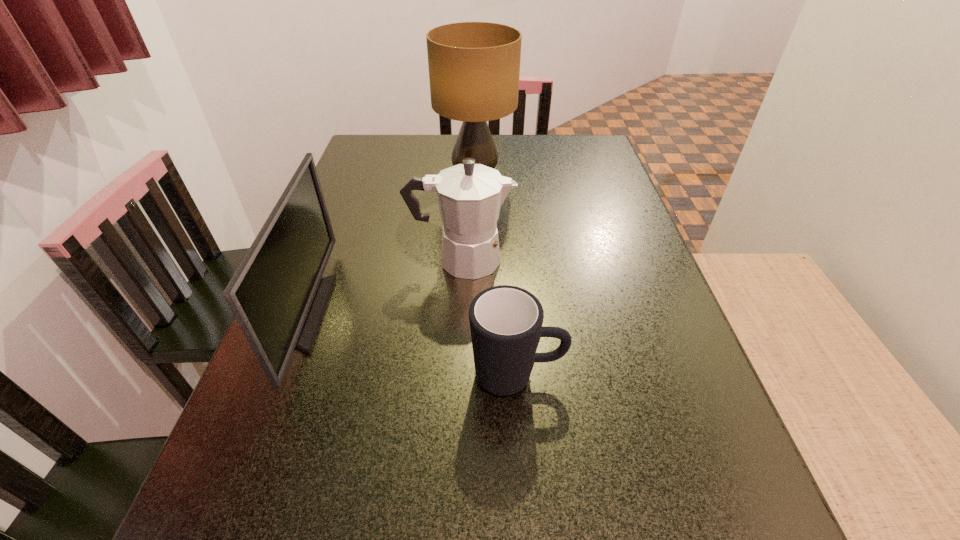
Find the location of a particular element. The image size is (960, 540). the farthest object is located at coordinates (474, 67).

This screenshot has width=960, height=540. Find the location of `lampshade`. lampshade is located at coordinates (474, 67).

Image resolution: width=960 pixels, height=540 pixels. I want to click on coffeepot, so click(x=469, y=195).

Where is `monitor`? The width and height of the screenshot is (960, 540). monitor is located at coordinates (277, 295).

The height and width of the screenshot is (540, 960). What are the coordinates of `mug` in the screenshot? It's located at (506, 321).

Identify the location of vacant space situated 0.080m on the front of the farthest object. [474, 214].

Where is `blank space located 0.220m at the spout of the coffeepot`? This screenshot has height=540, width=960. blank space located 0.220m at the spout of the coffeepot is located at coordinates (610, 259).

Image resolution: width=960 pixels, height=540 pixels. I want to click on vacant area located 0.180m on the screen side of the leftmost object, so click(x=414, y=313).

This screenshot has height=540, width=960. In order to click on vacant space located 0.150m on the side of the shortest object with the handle in this screenshot , I will do click(650, 375).

This screenshot has width=960, height=540. In order to click on object present at the far edge in this screenshot , I will do `click(474, 67)`.